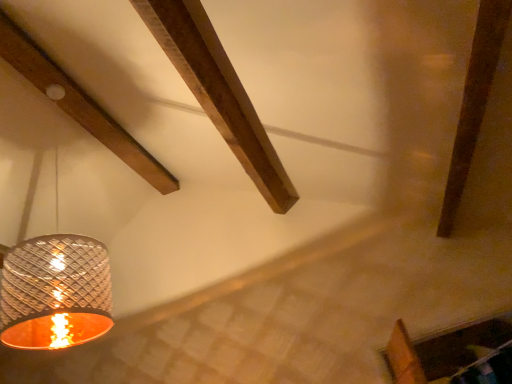
Question: In terms of width, does metallic textured lampshade at left look wider or thinner when compared to wooden beam at upper left?

Choices:
 (A) wide
 (B) thin

Answer: (B)

Question: Looking at the image, does metallic textured lampshade at left seem bigger or smaller compared to wooden beam at upper left?

Choices:
 (A) big
 (B) small

Answer: (A)

Question: In the image, is metallic textured lampshade at left positioned in front of or behind wooden beam at upper left?

Choices:
 (A) front
 (B) behind

Answer: (A)

Question: Considering the positions of wooden beam at upper left and metallic textured lampshade at left in the image, is wooden beam at upper left wider or thinner than metallic textured lampshade at left?

Choices:
 (A) wide
 (B) thin

Answer: (A)

Question: From a real-world perspective, is wooden beam at upper left positioned above or below metallic textured lampshade at left?

Choices:
 (A) below
 (B) above

Answer: (B)

Question: Is point (129, 147) closer or farther from the camera than point (52, 340)?

Choices:
 (A) closer
 (B) farther

Answer: (B)

Question: Considering the positions of wooden beam at upper left and metallic textured lampshade at left in the image, is wooden beam at upper left taller or shorter than metallic textured lampshade at left?

Choices:
 (A) short
 (B) tall

Answer: (A)